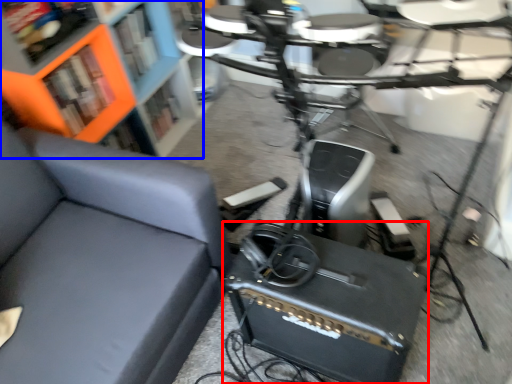
Question: Which object appears closest to the camera in this image, speaker (highlighted by a red box) or bookcase (highlighted by a blue box)?

Choices:
 (A) speaker
 (B) bookcase

Answer: (A)